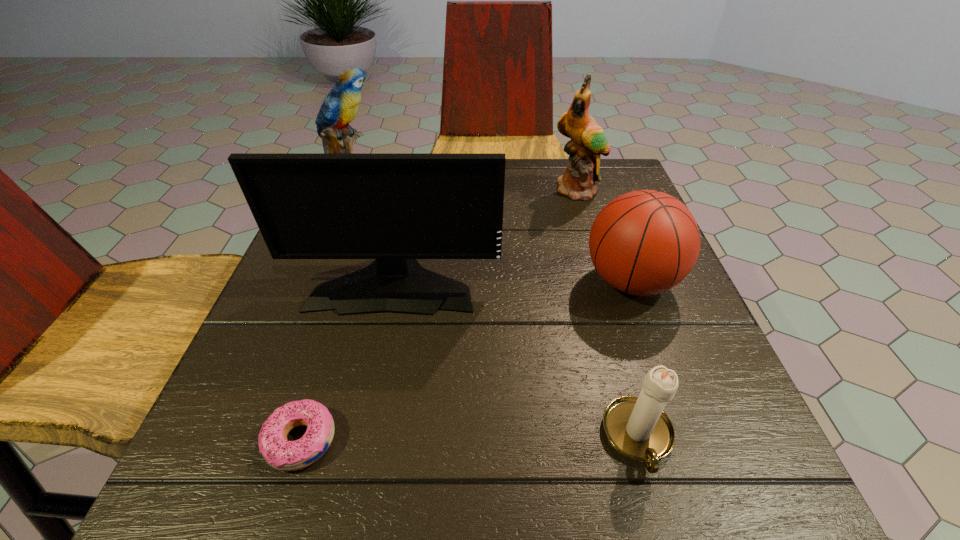
This screenshot has height=540, width=960. In order to click on vacant area situated 0.220m on the back of the doughnut in this screenshot , I will do `click(345, 302)`.

The image size is (960, 540). In order to click on candle holder at the near edge in this screenshot , I will do `click(637, 427)`.

Where is `doughnut present at the near edge`? This screenshot has height=540, width=960. doughnut present at the near edge is located at coordinates (281, 454).

This screenshot has width=960, height=540. I want to click on parrot present at the left edge, so click(x=340, y=107).

Image resolution: width=960 pixels, height=540 pixels. I want to click on monitor that is positioned at the left edge, so click(393, 207).

Identify the location of doughnut present at the left edge. This screenshot has width=960, height=540. (281, 454).

At what (x,y) coordinates should I click in order to perform the action: click on parrot present at the right edge. Please return your answer as a coordinate pair (x, y). Image resolution: width=960 pixels, height=540 pixels. Looking at the image, I should click on (588, 142).

The height and width of the screenshot is (540, 960). Identify the location of basketball present at the right edge. (645, 242).

The image size is (960, 540). In order to click on candle holder that is at the right edge in this screenshot , I will do `click(637, 427)`.

This screenshot has height=540, width=960. In order to click on object situated at the far left corner in this screenshot , I will do (340, 107).